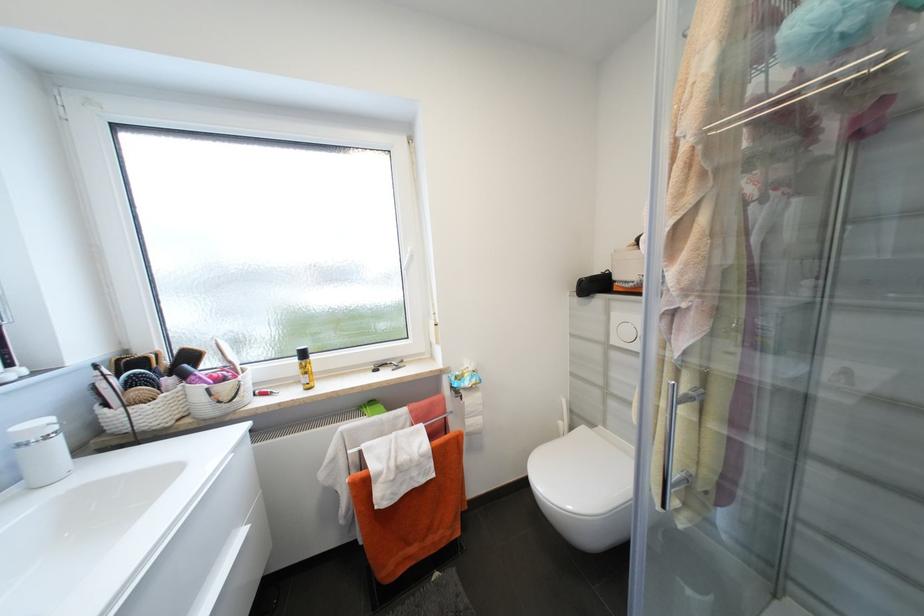
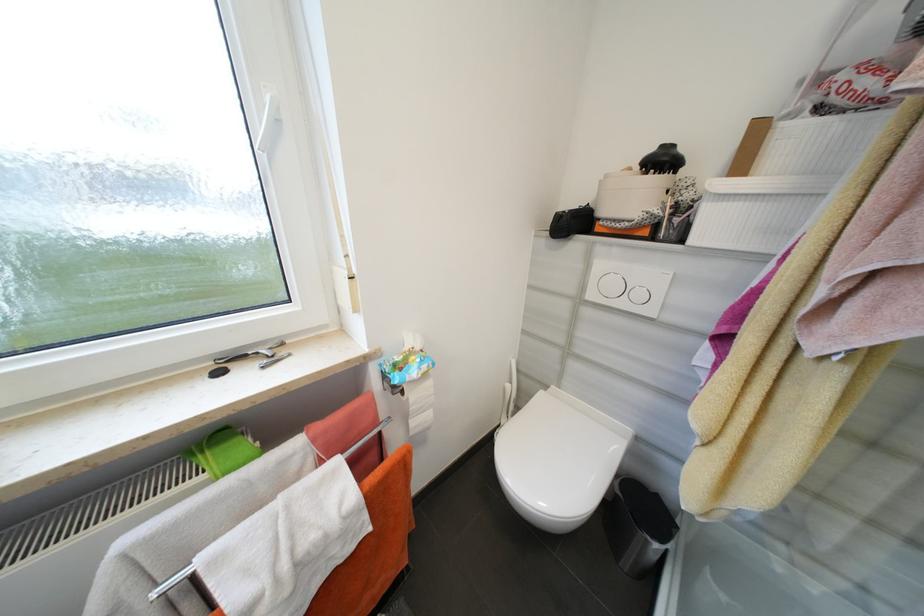
Where in the second image is the point corresponding to [599,427] from the first image?

(552, 387)